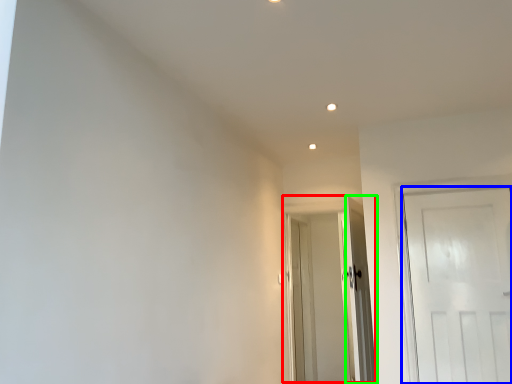
Question: Which object is the closest to the door (highlighted by a red box)? Choose among these: door (highlighted by a blue box) or door (highlighted by a green box).

Choices:
 (A) door
 (B) door

Answer: (B)